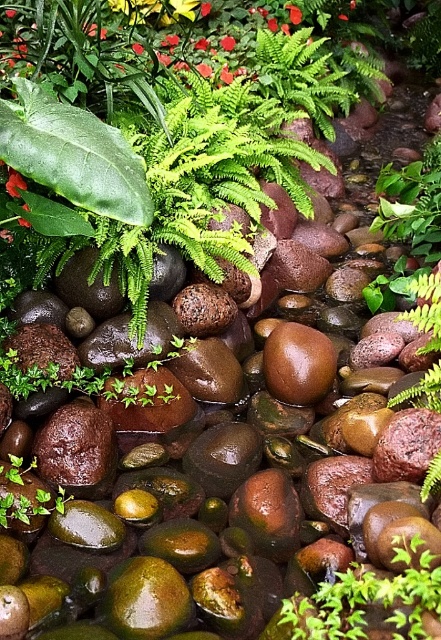
In the garden scene, there is a shiny brown rock at center and a smooth glossy petal at center. From the perspective of someone standing at the garden entrance, which object is positioned to the left?

The shiny brown rock at center is to the left of the smooth glossy petal at center, so from the entrance perspective, the shiny brown rock at center would be on the left side.

You are a gardener who wants to place a small statue between the shiny brown rock at center and the red matte flower at upper center. Based on their positions, where should the statue be placed?

The shiny brown rock at center is located below the red matte flower at upper center, so the statue should be placed between them in the middle area between the shiny brown rock at center and the red matte flower at upper center.

You are a gardener who needs to place a 3.0 meter long wooden plank between the shiny brown rock at center and the smooth glossy petal at center. Can the plank reach both objects without bending?

The distance between the shiny brown rock at center and the smooth glossy petal at center is 3.09 meters. Since the plank is 3.0 meters long, it is 0.09 meters shorter than the required distance. Therefore, the plank cannot reach both objects without bending.